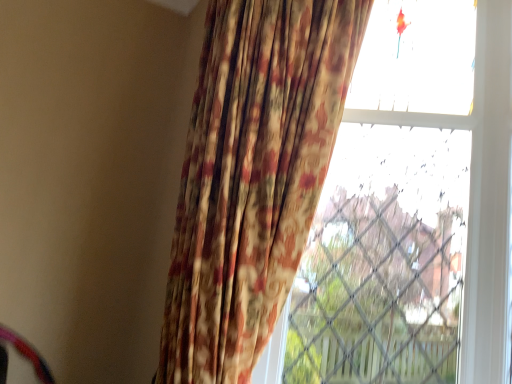
Locate an element on the screen. This screenshot has width=512, height=384. floral fabric curtain at center is located at coordinates (252, 176).

In order to face floral fabric curtain at center, should I rotate leftwards or rightwards?

Turn left by 3.411 degrees to look at floral fabric curtain at center.

Image resolution: width=512 pixels, height=384 pixels. What do you see at coordinates (252, 176) in the screenshot?
I see `floral fabric curtain at center` at bounding box center [252, 176].

Looking at this image, what is the approximate width of transparent glass window at upper right?

19.50 centimeters.

Where is `transparent glass window at upper right`? This screenshot has width=512, height=384. transparent glass window at upper right is located at coordinates (480, 190).

Describe the element at coordinates (480, 190) in the screenshot. I see `transparent glass window at upper right` at that location.

The height and width of the screenshot is (384, 512). What are the coordinates of `floral fabric curtain at center` in the screenshot? It's located at (252, 176).

Which is more to the left, floral fabric curtain at center or transparent glass window at upper right?

From the viewer's perspective, floral fabric curtain at center appears more on the left side.

Which object is closer to the camera, floral fabric curtain at center or transparent glass window at upper right?

Positioned in front is floral fabric curtain at center.

Which is nearer, [305,137] or [482,20]?

Point [305,137].

From the image's perspective, is floral fabric curtain at center located above or below transparent glass window at upper right?

From the image's perspective, floral fabric curtain at center appears above transparent glass window at upper right.

From a real-world perspective, between floral fabric curtain at center and transparent glass window at upper right, who is vertically lower?

floral fabric curtain at center.

Can you confirm if floral fabric curtain at center is wider than transparent glass window at upper right?

Yes.

In terms of height, does floral fabric curtain at center look taller or shorter compared to transparent glass window at upper right?

Clearly, floral fabric curtain at center is shorter compared to transparent glass window at upper right.

In terms of size, does floral fabric curtain at center appear bigger or smaller than transparent glass window at upper right?

Clearly, floral fabric curtain at center is larger in size than transparent glass window at upper right.

Is floral fabric curtain at center located outside transparent glass window at upper right?

Yes, floral fabric curtain at center is located beyond the bounds of transparent glass window at upper right.

Is floral fabric curtain at center beside transparent glass window at upper right?

No, floral fabric curtain at center is not with transparent glass window at upper right.

Is floral fabric curtain at center oriented away from transparent glass window at upper right?

Yes.

How different are the orientations of floral fabric curtain at center and transparent glass window at upper right in degrees?

floral fabric curtain at center and transparent glass window at upper right are facing 18.1 degrees away from each other.

Locate an element on the screen. curtain below the transparent glass window at upper right (from a real-world perspective) is located at coordinates (252, 176).

Is transparent glass window at upper right to the left or to the right of floral fabric curtain at center in the image?

Based on their positions, transparent glass window at upper right is located to the right of floral fabric curtain at center.

Is the position of transparent glass window at upper right less distant than that of floral fabric curtain at center?

That is False.

Which is closer to the camera, (488, 140) or (225, 305)?

Point (225, 305)

From the image's perspective, which is below, transparent glass window at upper right or floral fabric curtain at center?

transparent glass window at upper right, from the image's perspective.

From a real-world perspective, which object stands above the other?

In real-world perspective, transparent glass window at upper right is above.

Considering the sizes of objects transparent glass window at upper right and floral fabric curtain at center in the image provided, who is wider, transparent glass window at upper right or floral fabric curtain at center?

Wider between the two is floral fabric curtain at center.

From their relative heights in the image, would you say transparent glass window at upper right is taller or shorter than floral fabric curtain at center?

transparent glass window at upper right is taller than floral fabric curtain at center.

Considering the sizes of objects transparent glass window at upper right and floral fabric curtain at center in the image provided, who is smaller, transparent glass window at upper right or floral fabric curtain at center?

transparent glass window at upper right is smaller.

Which is correct: transparent glass window at upper right is inside floral fabric curtain at center, or outside of it?

transparent glass window at upper right exists outside the volume of floral fabric curtain at center.

Are transparent glass window at upper right and floral fabric curtain at center far apart?

They are positioned close to each other.

Is transparent glass window at upper right aimed at floral fabric curtain at center?

No, transparent glass window at upper right is not oriented towards floral fabric curtain at center.

How distant is transparent glass window at upper right from floral fabric curtain at center?

A distance of 54.50 centimeters exists between transparent glass window at upper right and floral fabric curtain at center.

This screenshot has width=512, height=384. Identify the location of window that appears above the floral fabric curtain at center (from a real-world perspective). (480, 190).

Find the location of a particular element. This screenshot has height=384, width=512. curtain above the transparent glass window at upper right (from the image's perspective) is located at coordinates (252, 176).

Locate an element on the screen. window behind the floral fabric curtain at center is located at coordinates (480, 190).